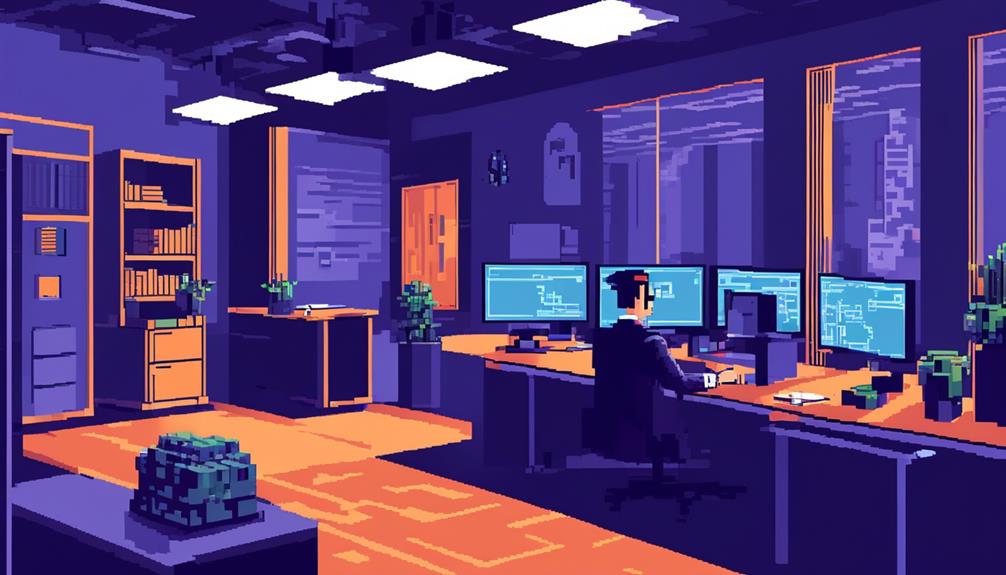
I want to click on ceiling, so click(365, 19), click(801, 14).